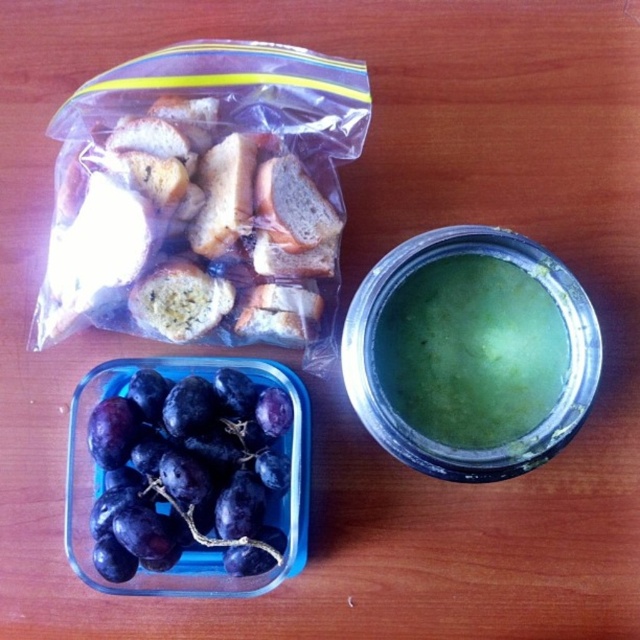
You are organizing a picnic basket and need to fit both the purple matte grapes at lower left and the green matte soup at upper right. Which item requires more space due to its size?

The purple matte grapes at lower left requires more space because it is bigger than the green matte soup at upper right.

You are arranging a picnic basket and need to place the purple matte grapes at lower left and the green matte soup at upper right. Based on their positions in the image, which item should you pack first to maintain their original arrangement?

The purple matte grapes at lower left should be packed first because they are located below the green matte soup at upper right in the image, so placing them lower ensures the original arrangement is maintained.

You are arranging a picnic basket and need to place the purple matte grapes at lower left and the green matte soup at upper right. Since the grapes are in front of the soup, will the grapes block the view of the soup when looking from above?

The purple matte grapes at lower left are in front of the green matte soup at upper right, so they will block the view of the soup when looking from above.